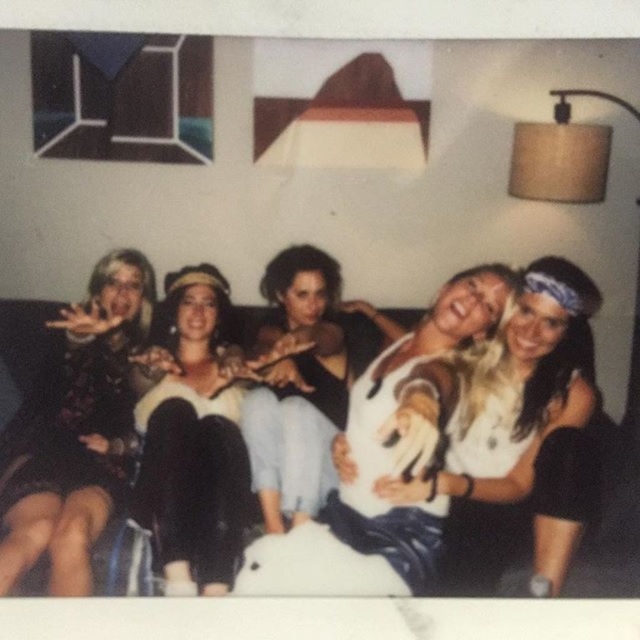
Who is positioned more to the left, black velvet dress at center or matte black sweater at center?

From the viewer's perspective, black velvet dress at center appears more on the left side.

Measure the distance between black velvet dress at center and camera.

The distance of black velvet dress at center from camera is 38.49 inches.

Which is in front, point (164, 532) or point (323, 397)?

Point (164, 532)

At what (x,y) coordinates should I click in order to perform the action: click on black velvet dress at center. Please return your answer as a coordinate pair (x, y). The width and height of the screenshot is (640, 640). Looking at the image, I should click on [x=193, y=442].

Does white fabric at center have a lesser height compared to matte floral dress at left?

Yes, white fabric at center is shorter than matte floral dress at left.

Does point (337, 449) come behind point (80, 500)?

Yes, point (337, 449) is farther from viewer.

At what (x,y) coordinates should I click in order to perform the action: click on white fabric at center. Please return your answer as a coordinate pair (x, y). Image resolution: width=640 pixels, height=640 pixels. Looking at the image, I should click on (518, 428).

Can you confirm if white fabric at center is bigger than white cotton shirt at center?

Correct, white fabric at center is larger in size than white cotton shirt at center.

Which is more to the left, white fabric at center or white cotton shirt at center?

Positioned to the left is white cotton shirt at center.

Locate an element on the screen. white fabric at center is located at coordinates (518, 428).